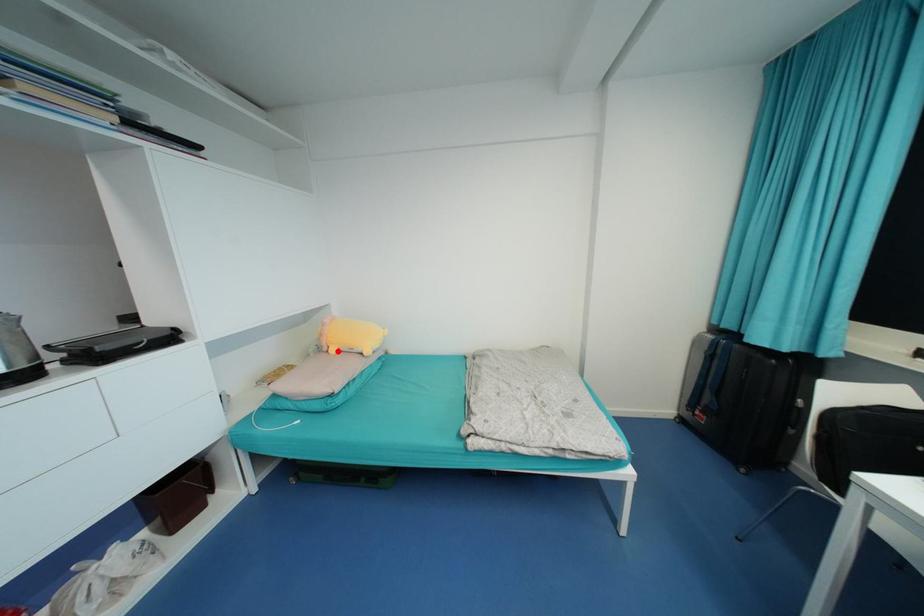
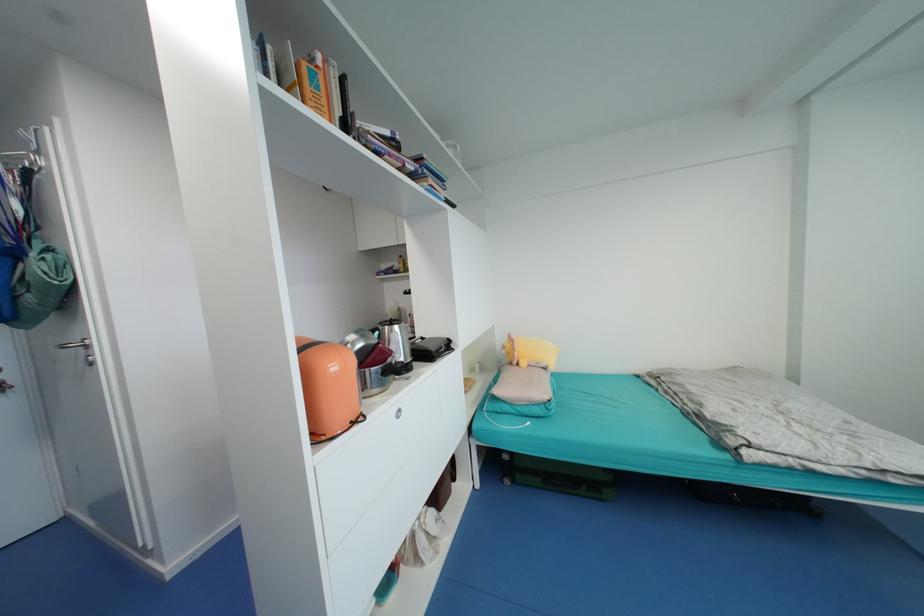
Question: I am providing you with two images of the same scene from different viewpoints. Image1 has a red point marked. In image2, the corresponding 3D location appears at what relative position? Reply with the corresponding letter.

Choices:
 (A) Closer
 (B) Farther

Answer: (B)